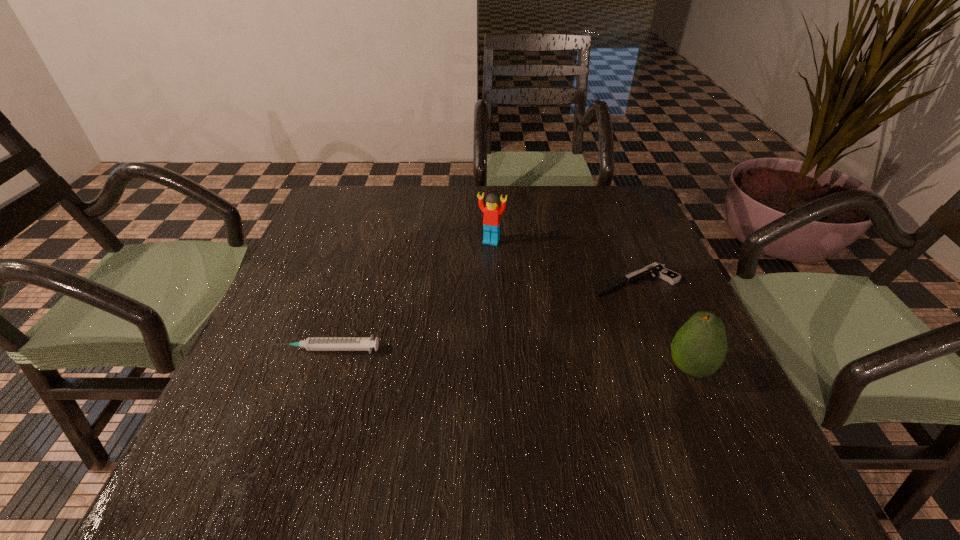
This screenshot has height=540, width=960. I want to click on vacant space at the near edge, so click(x=430, y=400).

Locate an element on the screen. The image size is (960, 540). free space at the left edge of the desktop is located at coordinates (343, 249).

Locate an element on the screen. This screenshot has height=540, width=960. free space at the right edge of the desktop is located at coordinates (600, 252).

The image size is (960, 540). Identify the location of free space at the far right corner of the desktop. (620, 230).

I want to click on blank region between the avocado and the third tallest object, so click(x=508, y=359).

I want to click on free point between the leftmost object and the farthest object, so pos(409,295).

The width and height of the screenshot is (960, 540). In order to click on vacant area that lies between the pistol and the avocado in this screenshot , I will do `click(661, 325)`.

Where is `free space between the avocado and the second shortest object`? The width and height of the screenshot is (960, 540). free space between the avocado and the second shortest object is located at coordinates (508, 359).

Locate an element on the screen. This screenshot has height=540, width=960. free space that is in between the leftmost object and the farthest object is located at coordinates (409, 295).

The width and height of the screenshot is (960, 540). What are the coordinates of `free space between the farthest object and the avocado` in the screenshot? It's located at point(590,305).